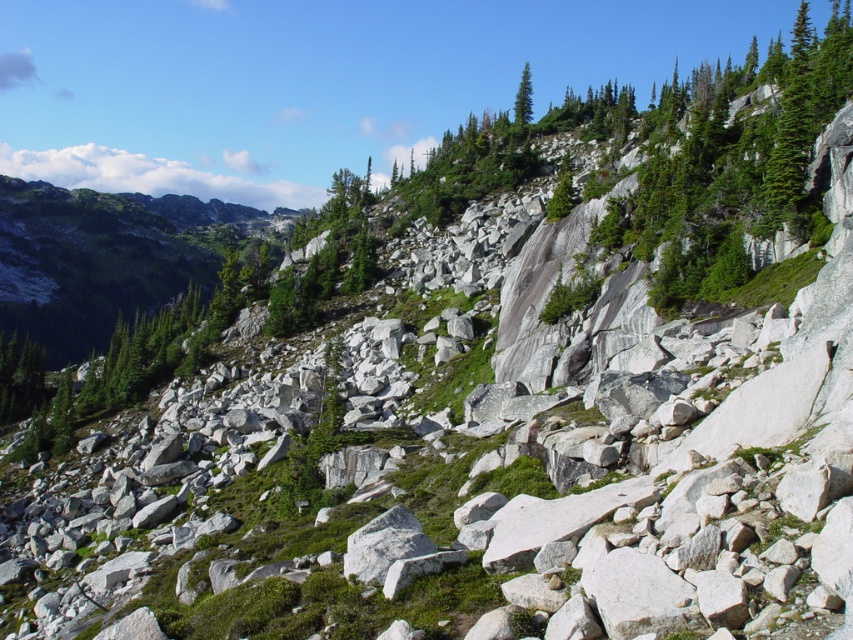
Question: Can you confirm if green mossy rock at upper left is positioned to the right of green textured tree at upper center?

Choices:
 (A) yes
 (B) no

Answer: (B)

Question: Can you confirm if green mossy rock at upper left is positioned above green textured tree at upper center?

Choices:
 (A) no
 (B) yes

Answer: (A)

Question: From the image, what is the correct spatial relationship of green mossy rock at upper left in relation to green textured tree at upper center?

Choices:
 (A) left
 (B) right

Answer: (A)

Question: Which object is farther from the camera taking this photo?

Choices:
 (A) green textured tree at upper center
 (B) green mossy rock at upper left

Answer: (B)